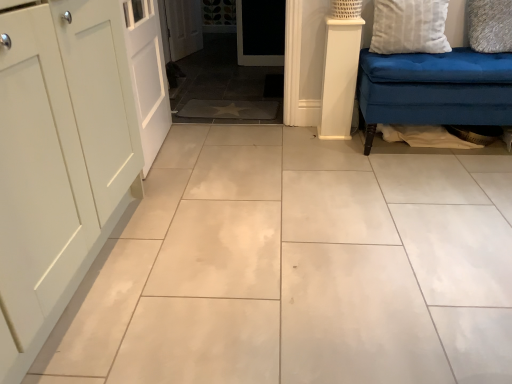
Where is `vacant space in front of white smooth column at right`? The image size is (512, 384). vacant space in front of white smooth column at right is located at coordinates (339, 139).